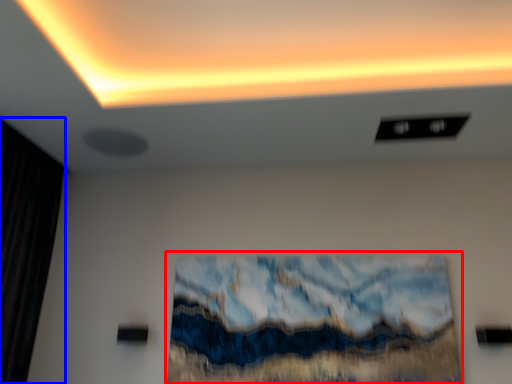
Question: Which object is further to the camera taking this photo, oil painting (highlighted by a red box) or curtain (highlighted by a blue box)?

Choices:
 (A) oil painting
 (B) curtain

Answer: (A)